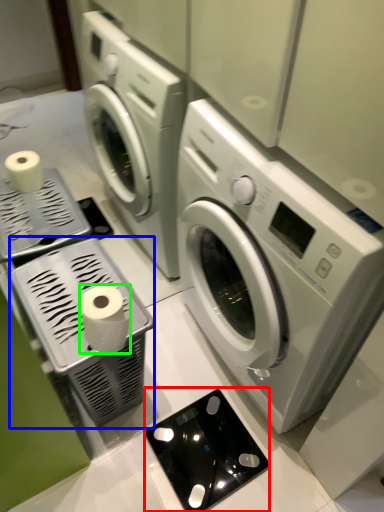
Question: Based on their relative distances, which object is farther from appliance (highlighted by a red box)? Choose from appliance (highlighted by a blue box) and toilet paper (highlighted by a green box).

Choices:
 (A) appliance
 (B) toilet paper

Answer: (B)